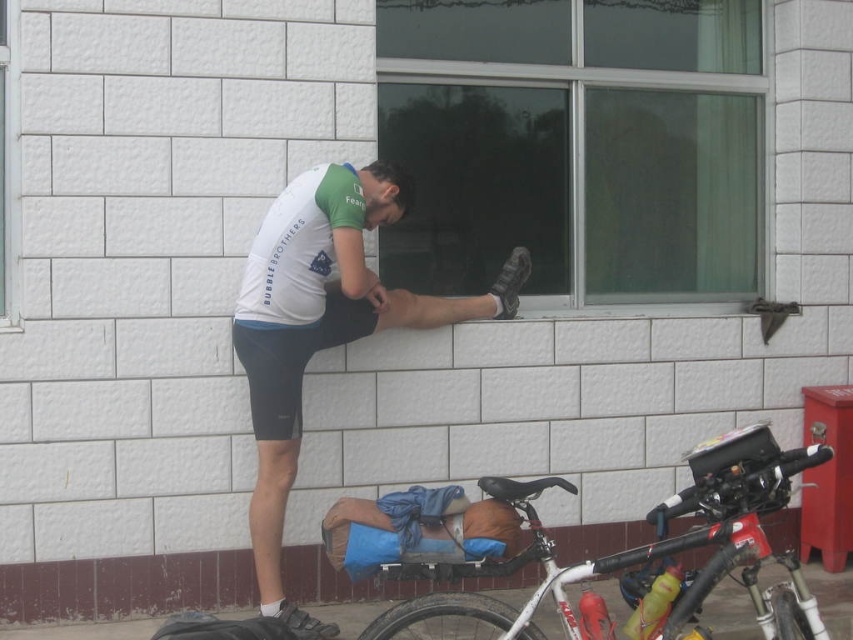
Does white matte shorts at center have a smaller size compared to white matte bicycle at lower center?

No.

Between white matte shorts at center and white matte bicycle at lower center, which one appears on the right side from the viewer's perspective?

From the viewer's perspective, white matte bicycle at lower center appears more on the right side.

Identify the location of white matte shorts at center. The image size is (853, 640). (323, 324).

You are a GUI agent. You are given a task and a screenshot of the screen. Output one action in this format:
    pyautogui.click(x=<x>, y=<y>)
    Task: Click on the white matte shorts at center
    
    Given the screenshot: What is the action you would take?
    pyautogui.click(x=323, y=324)

Can you confirm if white matte bicycle at lower center is wider than black rubber tire at lower center?

Yes.

Which is in front, point (720, 576) or point (440, 625)?

Positioned in front is point (720, 576).

In order to click on white matte bicycle at lower center in this screenshot , I will do `click(645, 556)`.

Where is `white matte bicycle at lower center`? Image resolution: width=853 pixels, height=640 pixels. white matte bicycle at lower center is located at coordinates (645, 556).

Does white matte shorts at center appear under black rubber tire at lower center?

Actually, white matte shorts at center is above black rubber tire at lower center.

Based on the photo, does white matte shorts at center appear on the right side of black rubber tire at lower center?

Incorrect, white matte shorts at center is not on the right side of black rubber tire at lower center.

Which is behind, point (283, 369) or point (514, 616)?

The point (283, 369) is more distant.

Locate an element on the screen. This screenshot has width=853, height=640. white matte shorts at center is located at coordinates (323, 324).